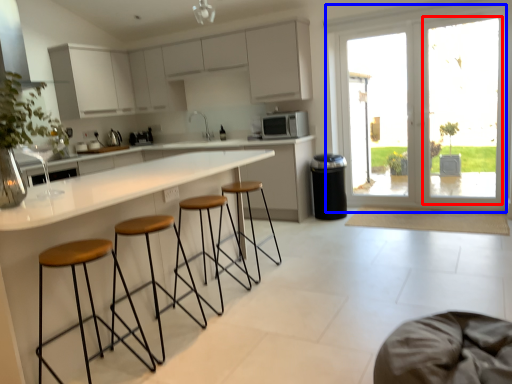
Question: Which of the following is the farthest to the observer, window screen (highlighted by a red box) or door (highlighted by a blue box)?

Choices:
 (A) window screen
 (B) door

Answer: (B)